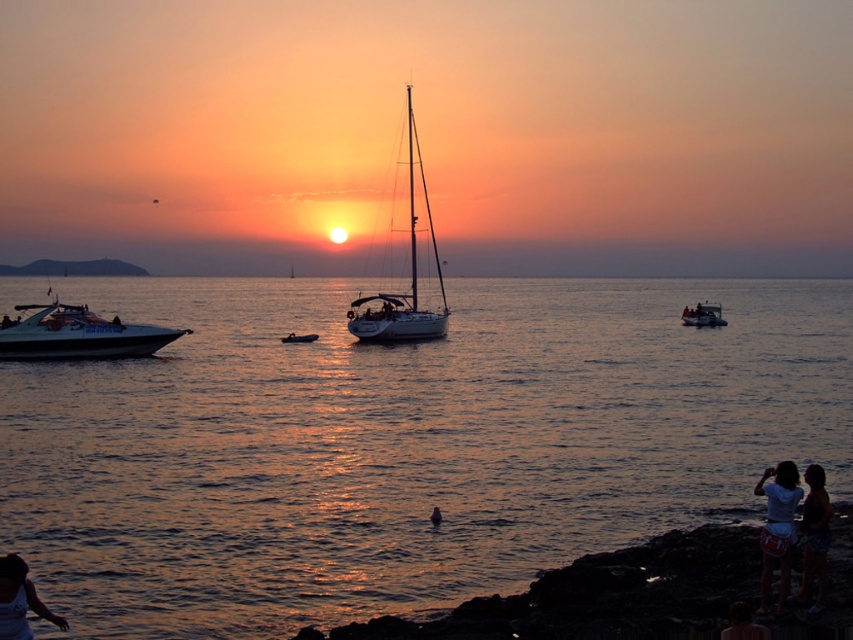
Question: Which of the following is the farthest from the observer?

Choices:
 (A) (480, 244)
 (B) (33, 349)
 (C) (822, 545)

Answer: (A)

Question: Is white glossy speedboat at left to the right of dark hair at lower left from the viewer's perspective?

Choices:
 (A) no
 (B) yes

Answer: (A)

Question: Which point appears closest to the camera in this image?

Choices:
 (A) (309, 333)
 (B) (323, 637)
 (C) (761, 545)

Answer: (B)

Question: Is white glossy sailboat at center smaller than smooth skin person at lower right?

Choices:
 (A) no
 (B) yes

Answer: (A)

Question: Is white glossy speedboat at left below metallic silver dinghy at center?

Choices:
 (A) no
 (B) yes

Answer: (A)

Question: Considering the real-world distances, which object is farthest from the dark rock shoreline at lower right?

Choices:
 (A) white cotton shorts at lower right
 (B) white cotton shirt at lower right

Answer: (B)